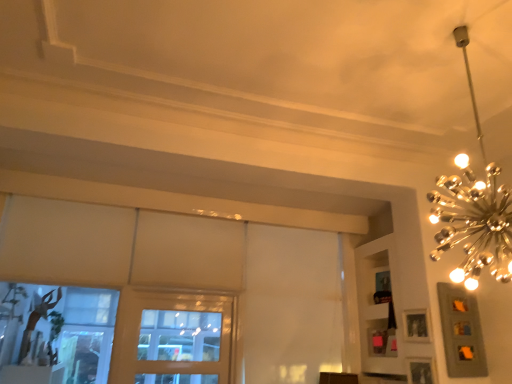
Question: Is gold metallic chandelier at upper right further to camera compared to wooden window at center?

Choices:
 (A) yes
 (B) no

Answer: (B)

Question: Can you confirm if gold metallic chandelier at upper right is shorter than wooden window at center?

Choices:
 (A) yes
 (B) no

Answer: (B)

Question: Is gold metallic chandelier at upper right located outside wooden window at center?

Choices:
 (A) no
 (B) yes

Answer: (B)

Question: Considering the relative positions of gold metallic chandelier at upper right and wooden window at center in the image provided, is gold metallic chandelier at upper right to the left of wooden window at center from the viewer's perspective?

Choices:
 (A) no
 (B) yes

Answer: (A)

Question: Is gold metallic chandelier at upper right looking in the opposite direction of wooden window at center?

Choices:
 (A) no
 (B) yes

Answer: (A)

Question: Can you confirm if gold metallic chandelier at upper right is wider than wooden window at center?

Choices:
 (A) no
 (B) yes

Answer: (B)

Question: Is matte silver picture frame at upper right, which ranks as the 2th picture frame in bottom-to-top order, to the left of wooden window at center from the viewer's perspective?

Choices:
 (A) yes
 (B) no

Answer: (B)

Question: Could you tell me if matte silver picture frame at upper right, the first picture frame positioned from the top, is facing wooden window at center?

Choices:
 (A) yes
 (B) no

Answer: (B)

Question: From the image's perspective, would you say matte silver picture frame at upper right, which ranks as the 2th picture frame in bottom-to-top order, is shown under wooden window at center?

Choices:
 (A) no
 (B) yes

Answer: (A)

Question: Can you confirm if matte silver picture frame at upper right, which ranks as the 2th picture frame in bottom-to-top order, is wider than wooden window at center?

Choices:
 (A) yes
 (B) no

Answer: (B)

Question: Is matte silver picture frame at upper right, the first picture frame positioned from the top, to the right of wooden window at center from the viewer's perspective?

Choices:
 (A) yes
 (B) no

Answer: (A)

Question: Is wooden window at center a part of matte silver picture frame at upper right, the first picture frame positioned from the top?

Choices:
 (A) yes
 (B) no

Answer: (B)

Question: Is gold metallic chandelier at upper right shorter than wooden picture frame at lower right, the first picture frame ordered from the bottom?

Choices:
 (A) yes
 (B) no

Answer: (B)